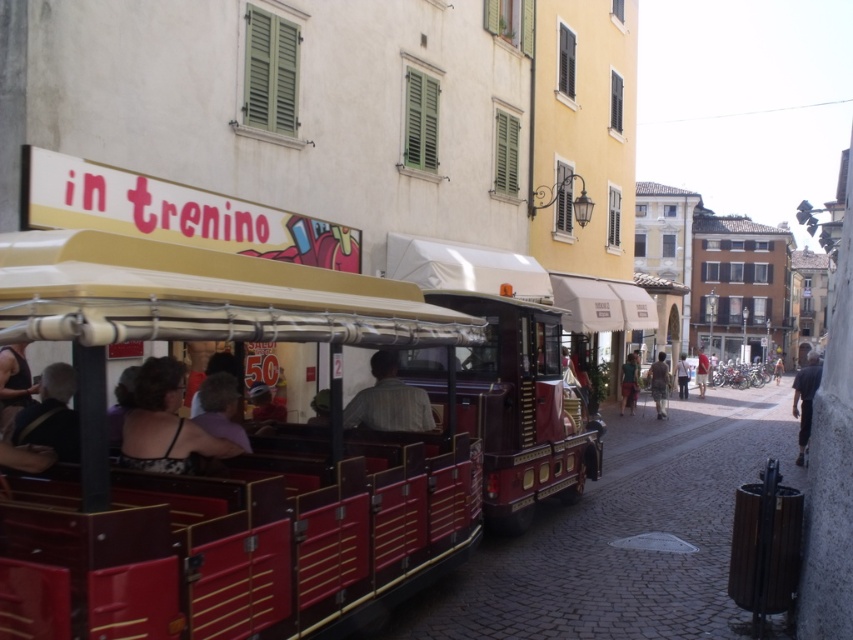
Who is higher up, shiny red trolley at center or red cotton shirt at center?

shiny red trolley at center

From the picture: Who is taller, shiny red trolley at center or red cotton shirt at center?

Standing taller between the two is shiny red trolley at center.

Between point (561, 476) and point (704, 356), which one is positioned in front?

Point (561, 476)

Where is `shiny red trolley at center`? shiny red trolley at center is located at coordinates (508, 378).

Which of these two, metallic red tram at center or shiny red trolley at center, stands taller?

shiny red trolley at center is taller.

Locate an element on the screen. metallic red tram at center is located at coordinates (215, 452).

Where is `metallic red tram at center`? The height and width of the screenshot is (640, 853). metallic red tram at center is located at coordinates (215, 452).

Between metallic red tram at center and brown textured shirt at center, which one is positioned lower?

Positioned lower is brown textured shirt at center.

Between point (267, 499) and point (665, 397), which one is positioned in front?

Point (267, 499) is in front.

The width and height of the screenshot is (853, 640). What are the coordinates of `metallic red tram at center` in the screenshot? It's located at pos(215,452).